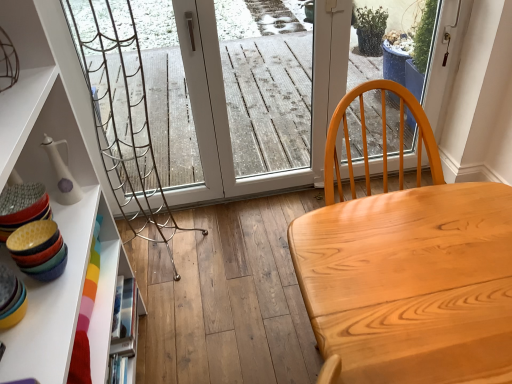
Describe the element at coordinates (411, 283) in the screenshot. The width and height of the screenshot is (512, 384). I see `light brown wood table at center` at that location.

Measure the distance between light brown wood table at center and camera.

light brown wood table at center and camera are 31.22 inches apart from each other.

Locate an element on the screen. This screenshot has height=384, width=512. light brown wood table at center is located at coordinates (411, 283).

Find the location of a particular element. This screenshot has width=512, height=384. light brown wood table at center is located at coordinates (411, 283).